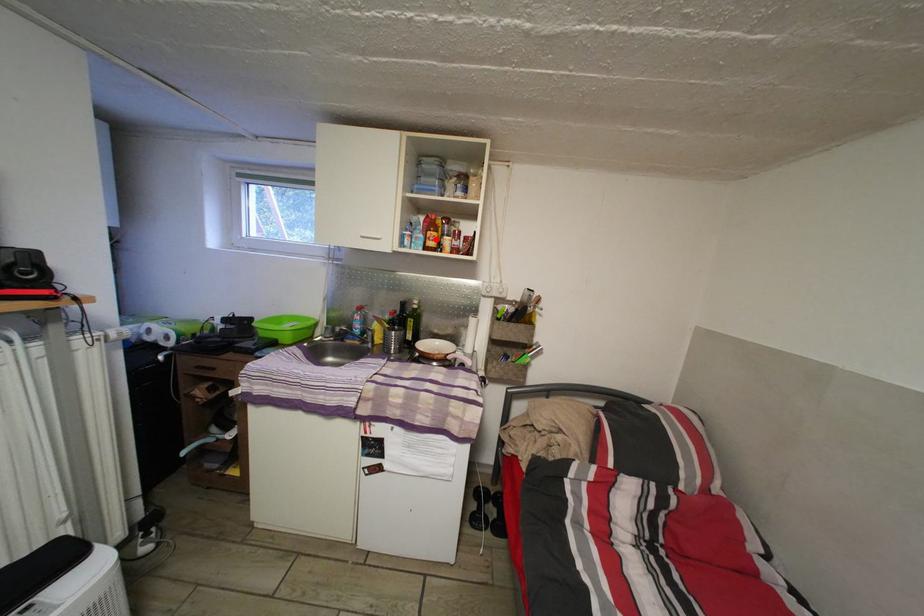
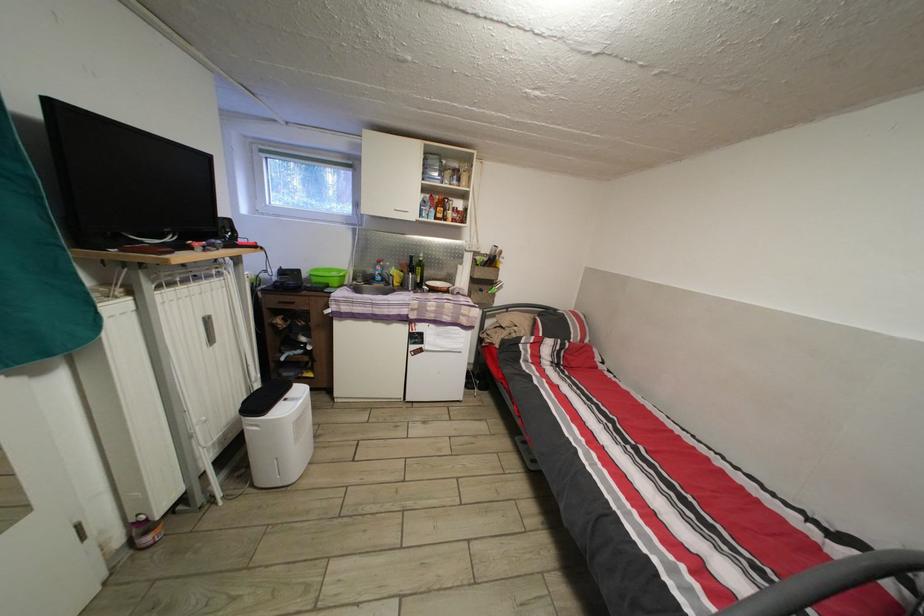
The point at the highlighted location is marked in the first image. Where is the corresponding point in the second image?

(445, 215)